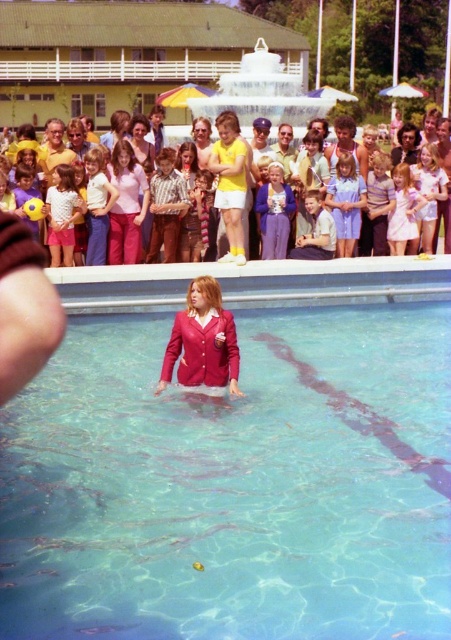
You are a photographer standing at the edge of the pool. You want to take a photo of the clear glass water at center and the light blue cotton dress at center. If your camera can focus on objects within 5 meters of each other, will both objects be in focus?

The clear glass water at center is 6.86 meters from the light blue cotton dress at center. Since the distance between them exceeds the camera focus range of 5 meters, both objects cannot be in focus at the same time.

You are a photographer trying to capture a closeup of the light blue cotton dress at center and the matte yellow shorts at center. Which clothing item would you need to adjust your camera focus settings for first if you want to ensure both are in focus, considering their sizes?

The light blue cotton dress at center is thinner than matte yellow shorts at center, so you should focus on the matte yellow shorts at center first since it is thicker and might require more precise focus to capture details clearly.